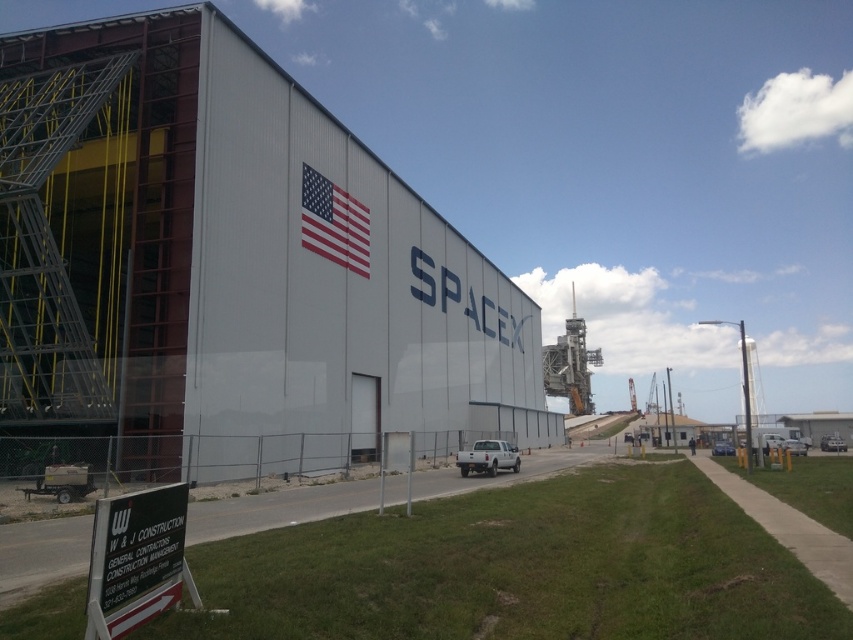
Consider the image. Is white matte truck at center to the right of metallic blue sedan at center from the viewer's perspective?

No, white matte truck at center is not to the right of metallic blue sedan at center.

Which of these two, white matte truck at center or metallic blue sedan at center, stands shorter?

white matte truck at center

Locate an element on the screen. white matte truck at center is located at coordinates (488, 458).

Does white plastic sign at lower left have a lesser height compared to silver metallic sedan at lower right?

In fact, white plastic sign at lower left may be taller than silver metallic sedan at lower right.

This screenshot has width=853, height=640. Find the location of `white plastic sign at lower left`. white plastic sign at lower left is located at coordinates (136, 560).

Describe the element at coordinates (136, 560) in the screenshot. This screenshot has width=853, height=640. I see `white plastic sign at lower left` at that location.

This screenshot has width=853, height=640. I want to click on white plastic sign at lower left, so click(x=136, y=560).

Between silver metallic sedan at lower right and metallic blue sedan at center, which one has less height?

Standing shorter between the two is silver metallic sedan at lower right.

Which is behind, point (828, 445) or point (718, 442)?

The point (718, 442) is behind.

Does point (831, 440) lie in front of point (729, 451)?

No, (831, 440) is further to viewer.

Locate an element on the screen. silver metallic sedan at lower right is located at coordinates (833, 444).